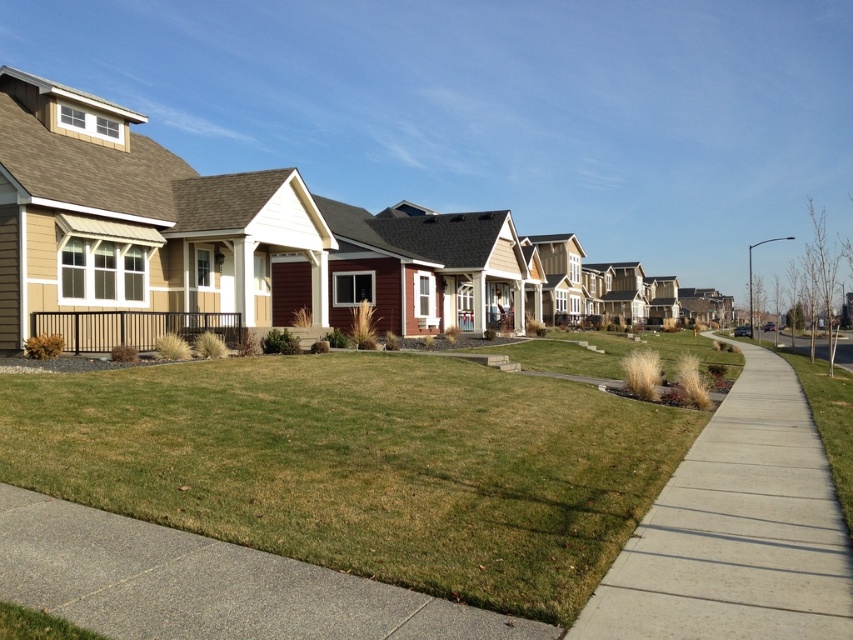
Question: Which object appears farthest from the camera in this image?

Choices:
 (A) gray concrete sidewalk at lower center
 (B) concrete sidewalk at center

Answer: (B)

Question: Is green grass at center wider than concrete sidewalk at center?

Choices:
 (A) no
 (B) yes

Answer: (B)

Question: Which of the following is the closest to the observer?

Choices:
 (A) (737, 481)
 (B) (184, 390)
 (C) (294, 628)

Answer: (C)

Question: Does concrete sidewalk at center appear over gray concrete sidewalk at lower center?

Choices:
 (A) no
 (B) yes

Answer: (A)

Question: In this image, where is concrete sidewalk at center located relative to gray concrete sidewalk at lower center?

Choices:
 (A) above
 (B) below

Answer: (B)

Question: Which object is positioned farthest from the gray concrete sidewalk at lower center?

Choices:
 (A) green grass at center
 (B) concrete sidewalk at center

Answer: (B)